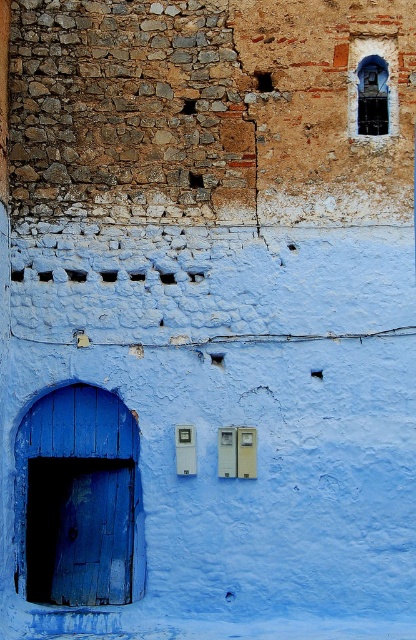
You are standing in front of the building wall and want to enter through the matte blue wooden door at left. To do so, you need to walk around the dark glass window at upper right. Is the door located below the window?

The matte blue wooden door at left is positioned under the dark glass window at upper right, so yes, the door is located below the window.

You are standing in front of a building wall that has a stone section above and a blue painted section below. There is a specific point marked at coordinates point (x=118, y=513). If you want to throw a small ball to hit that point, considering your throwing range is up to 15 meters, will you be able to reach it?

The distance of point (x=118, y=513) from camera is 17.23 meters, which is beyond your throwing range of 15 meters. Therefore, you cannot reach the point with the ball.

You are a painter assessing the wall for a new mural. You notice the matte blue wooden door at left and the dark blue stone window at upper right. Which object should you avoid painting over to ensure the mural doesn

The dark blue stone window at upper right is shorter than the matte blue wooden door at left, so painting around the shorter dark blue stone window at upper right would be easier to avoid obstructing the door.